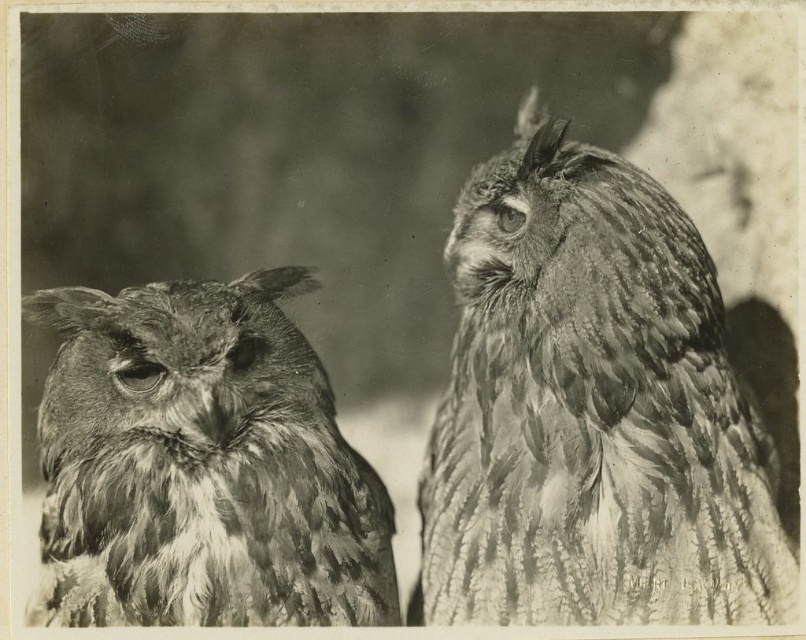
Question: Where is ruffled feather owl at right located in relation to rough feathered owl at left in the image?

Choices:
 (A) right
 (B) left

Answer: (A)

Question: Which point appears closest to the camera in this image?

Choices:
 (A) (260, 333)
 (B) (480, 304)

Answer: (A)

Question: Considering the relative positions of ruffled feather owl at right and rough feathered owl at left in the image provided, where is ruffled feather owl at right located with respect to rough feathered owl at left?

Choices:
 (A) left
 (B) right

Answer: (B)

Question: Is ruffled feather owl at right above rough feathered owl at left?

Choices:
 (A) no
 (B) yes

Answer: (B)